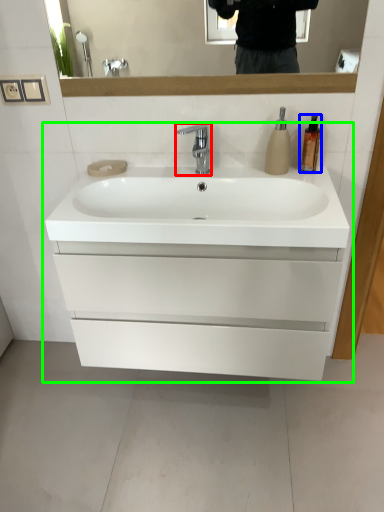
Question: Which is nearer to the tap (highlighted by a red box)? soap dispenser (highlighted by a blue box) or bathroom cabinet (highlighted by a green box).

Choices:
 (A) soap dispenser
 (B) bathroom cabinet

Answer: (A)